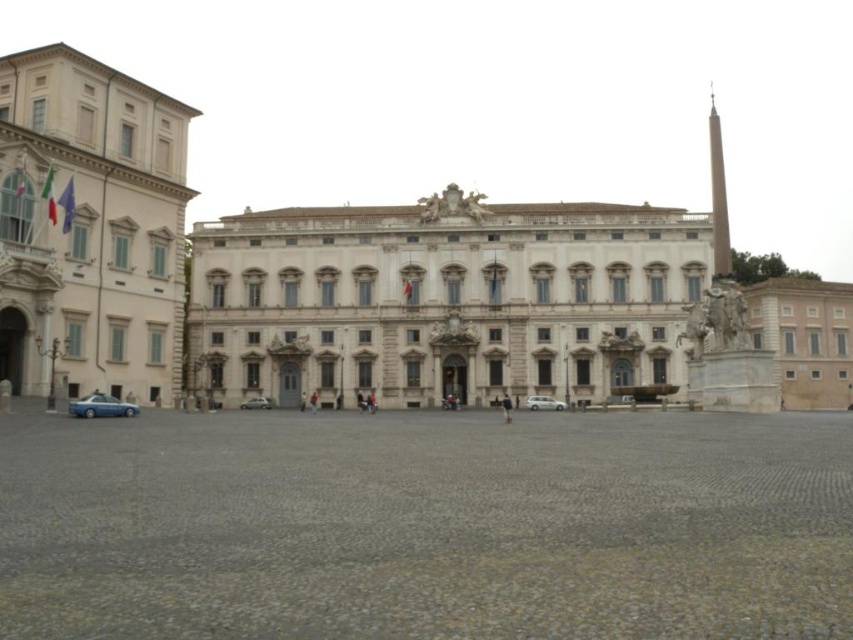
Can you confirm if white matte car at center is positioned to the right of silver metallic car at center?

Indeed, white matte car at center is positioned on the right side of silver metallic car at center.

Between white matte car at center and silver metallic car at center, which one appears on the left side from the viewer's perspective?

silver metallic car at center is more to the left.

Between point (544, 406) and point (260, 406), which one is positioned in front?

Point (544, 406) is more forward.

Locate an element on the screen. white matte car at center is located at coordinates (543, 403).

Between point (779, 300) and point (120, 412), which one is positioned in front?

Positioned in front is point (120, 412).

Does white stone sculpture at right appear under blue metallic car at lower left?

Actually, white stone sculpture at right is above blue metallic car at lower left.

Where is `white stone sculpture at right`? The height and width of the screenshot is (640, 853). white stone sculpture at right is located at coordinates (805, 337).

Is point (129, 410) positioned before point (259, 401)?

Yes, it is.

Measure the distance between point (94, 410) and camera.

72.86 meters

This screenshot has height=640, width=853. Find the location of `blue metallic car at lower left`. blue metallic car at lower left is located at coordinates (102, 406).